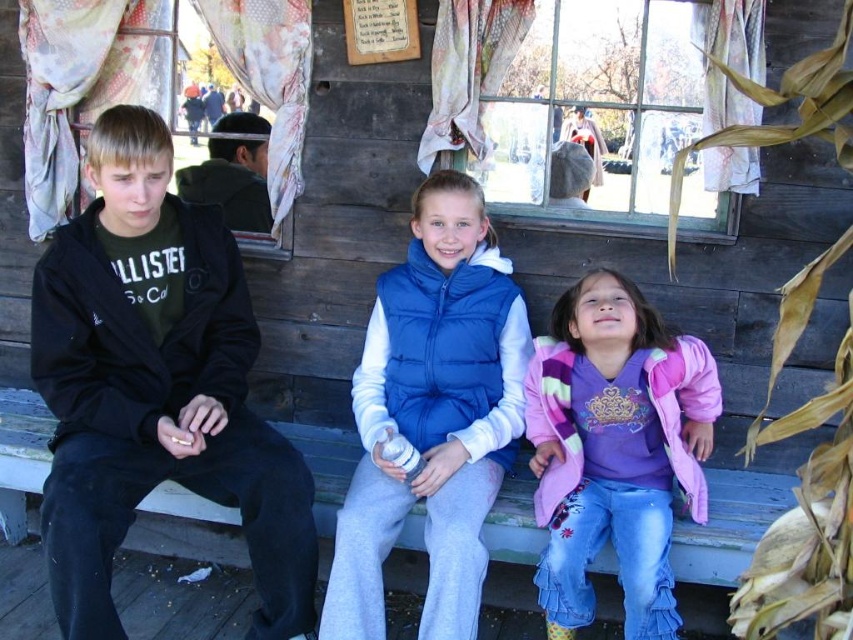
Describe the element at coordinates (155, 387) in the screenshot. I see `black matte jacket at left` at that location.

Who is taller, black matte jacket at left or blue puffy vest at center?

Standing taller between the two is black matte jacket at left.

This screenshot has height=640, width=853. In order to click on black matte jacket at left in this screenshot , I will do `click(155, 387)`.

This screenshot has width=853, height=640. I want to click on black matte jacket at left, so click(155, 387).

Looking at this image, does black matte jacket at left have a larger size compared to pink fleece jacket at lower right?

Indeed, black matte jacket at left has a larger size compared to pink fleece jacket at lower right.

Who is shorter, black matte jacket at left or pink fleece jacket at lower right?

Standing shorter between the two is pink fleece jacket at lower right.

Between point (253, 477) and point (625, 460), which one is positioned behind?

Point (625, 460)

At what (x,y) coordinates should I click in order to perform the action: click on black matte jacket at left. Please return your answer as a coordinate pair (x, y). Looking at the image, I should click on (155, 387).

You are a GUI agent. You are given a task and a screenshot of the screen. Output one action in this format:
    pyautogui.click(x=<x>, y=<y>)
    Task: Click on the blue puffy vest at center
    
    Given the screenshot: What is the action you would take?
    pyautogui.click(x=432, y=413)

How far apart are blue puffy vest at center and pink fleece jacket at lower right?

A: blue puffy vest at center and pink fleece jacket at lower right are 16.16 inches apart.

Who is more forward, [384,376] or [627,394]?

Point [627,394] is in front.

The height and width of the screenshot is (640, 853). I want to click on blue puffy vest at center, so click(432, 413).